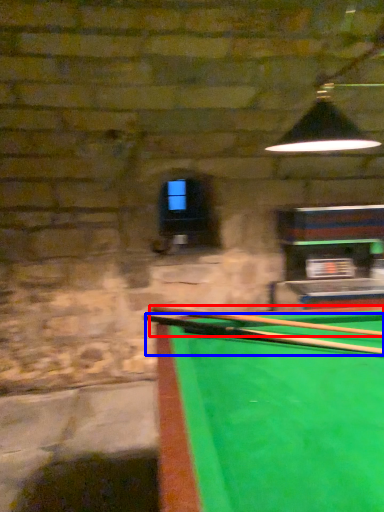
Question: Which object appears farthest to the camera in this image, cue (highlighted by a red box) or cue (highlighted by a blue box)?

Choices:
 (A) cue
 (B) cue

Answer: (A)